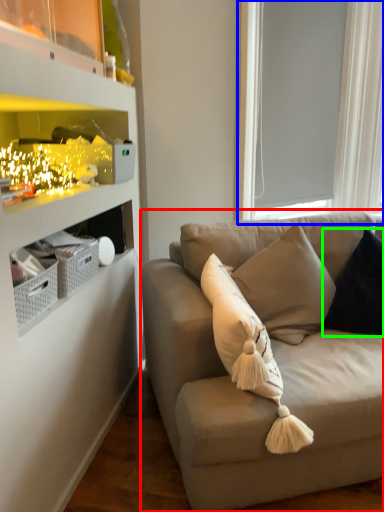
Question: Estimate the real-world distances between objects in this image. Which object is closer to studio couch (highlighted by a red box), window screen (highlighted by a blue box) or pillow (highlighted by a green box)?

Choices:
 (A) window screen
 (B) pillow

Answer: (B)